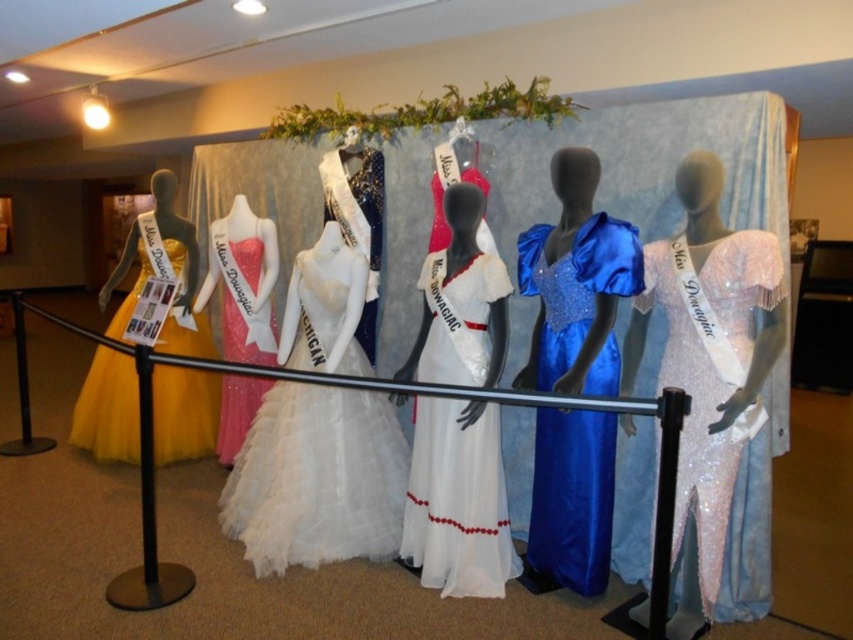
What are the coordinates of the shiny sequined dress at center in the image?

The coordinates of the shiny sequined dress at center are at point (709, 365).

Looking at this image, you are standing in front of the display of formal dresses and want to reach both the point at coordinates point (561, 355) and point (236, 352). Which point will you need to reach first if you move towards them in order of proximity?

Point (561, 355) is closer to the viewer than point (236, 352), so you will need to reach point (561, 355) first.